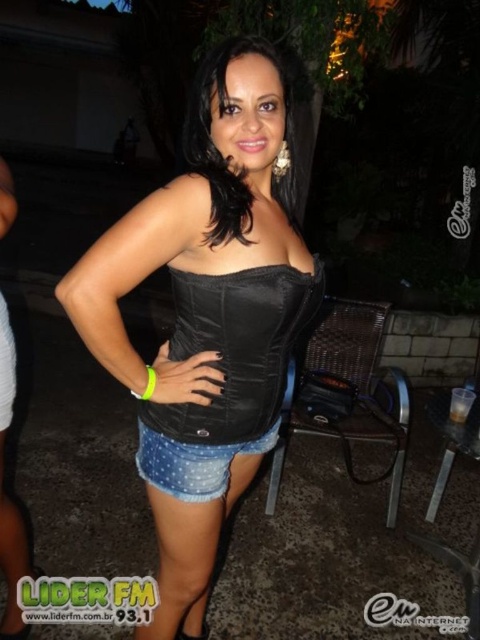
How far apart are black leather corset at center and black satin corset at center?

A distance of 11.48 inches exists between black leather corset at center and black satin corset at center.

Who is positioned more to the left, black leather corset at center or black satin corset at center?

Positioned to the left is black leather corset at center.

Where is `black leather corset at center`? black leather corset at center is located at coordinates (237, 348).

Is black leather top at center bigger than black satin corset at center?

Yes, black leather top at center is bigger than black satin corset at center.

Between point (264, 380) and point (211, 221), which one is positioned behind?

The point (264, 380) is more distant.

Where is `black leather top at center`? The width and height of the screenshot is (480, 640). black leather top at center is located at coordinates (204, 317).

Is black leather top at center to the left of black leather corset at center from the viewer's perspective?

Indeed, black leather top at center is positioned on the left side of black leather corset at center.

Which is in front, point (190, 196) or point (252, 428)?

Positioned in front is point (190, 196).

At what (x,y) coordinates should I click in order to perform the action: click on black leather top at center. Please return your answer as a coordinate pair (x, y). Looking at the image, I should click on tap(204, 317).